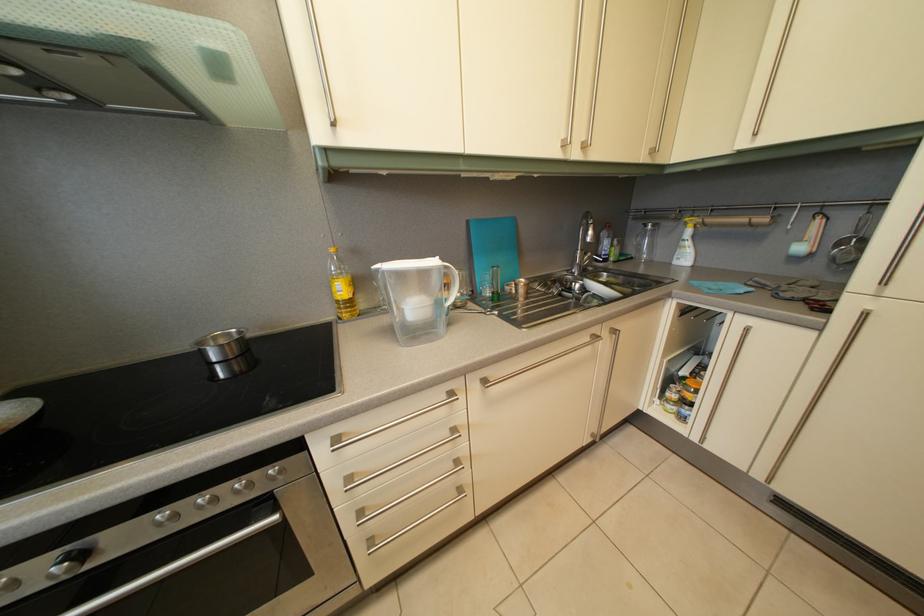
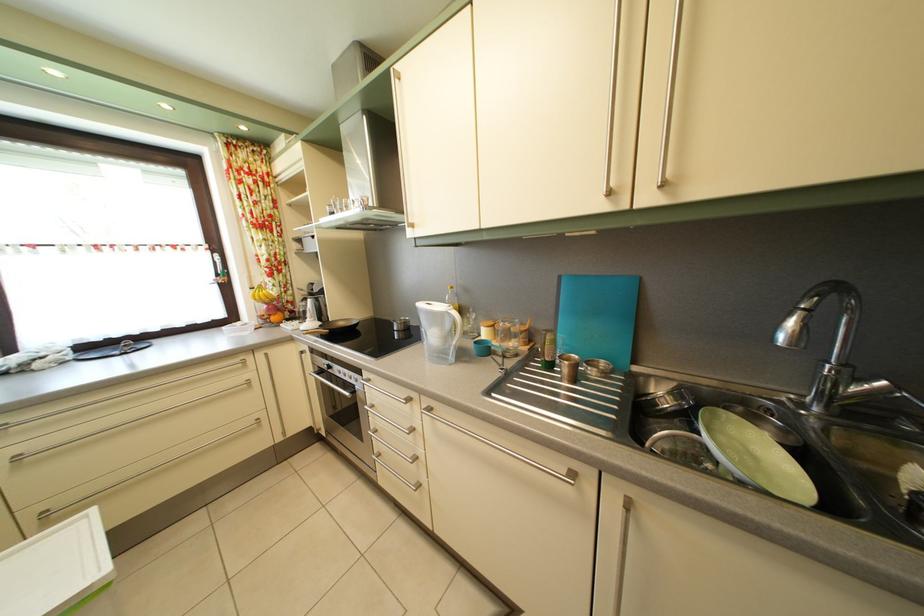
Where in the second image is the point corresponding to pixel 358 487 from the first image?

(381, 414)